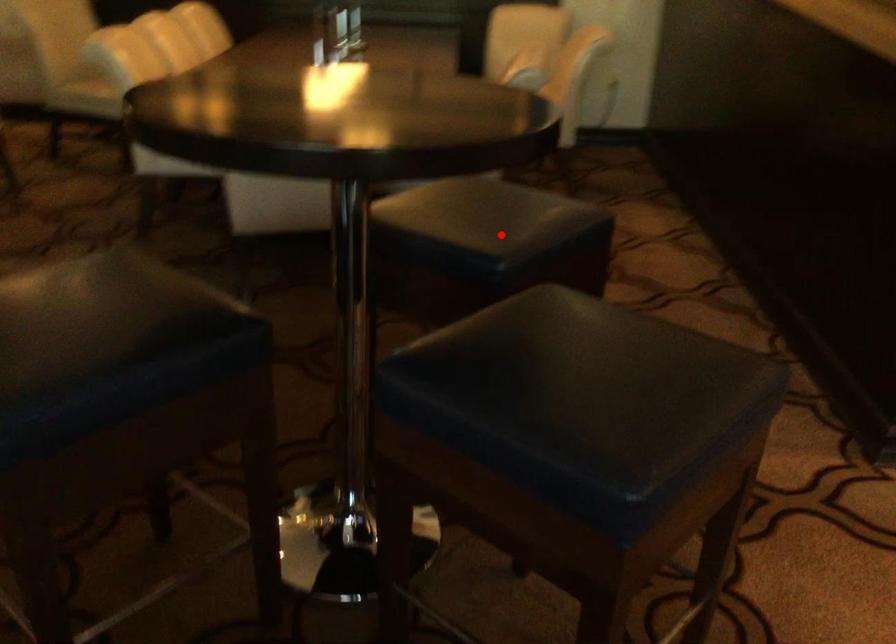
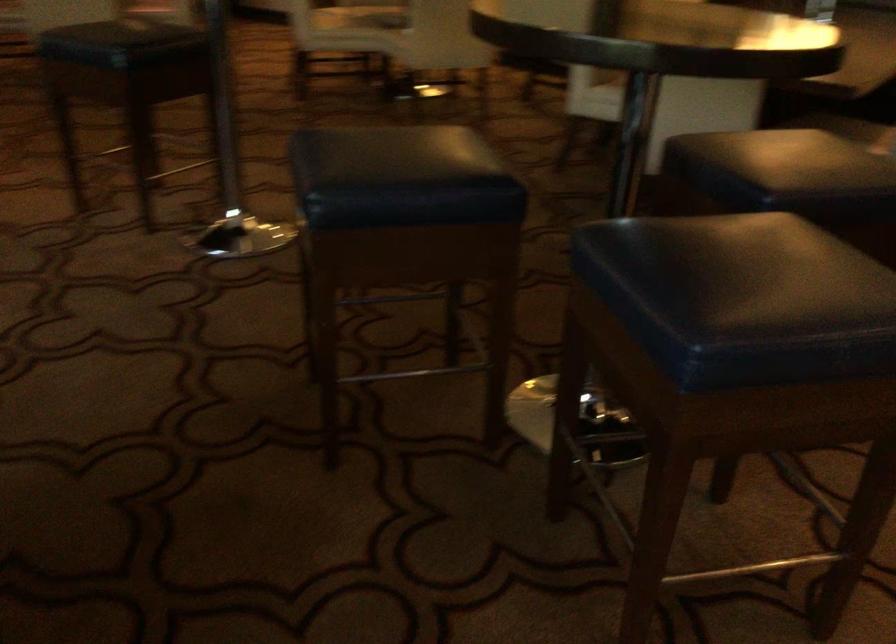
Question: I am providing you with two images of the same scene from different viewpoints. A red point is marked on the first image. At the location where the point appears in image 1, is it still visible in image 2?

Choices:
 (A) Yes
 (B) No

Answer: (A)